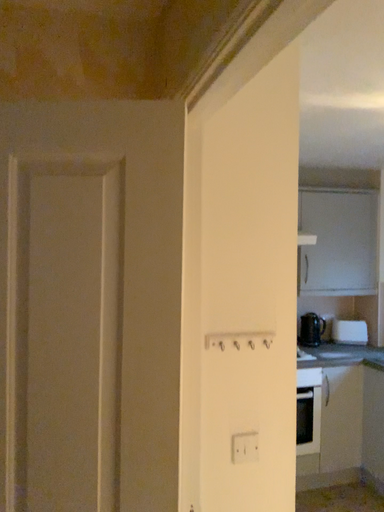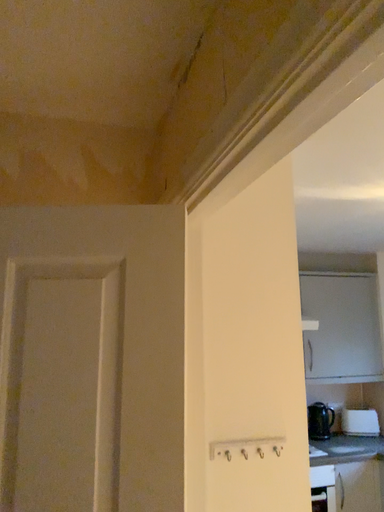
Question: Which way did the camera rotate in the video?

Choices:
 (A) rotated downward
 (B) rotated upward

Answer: (B)